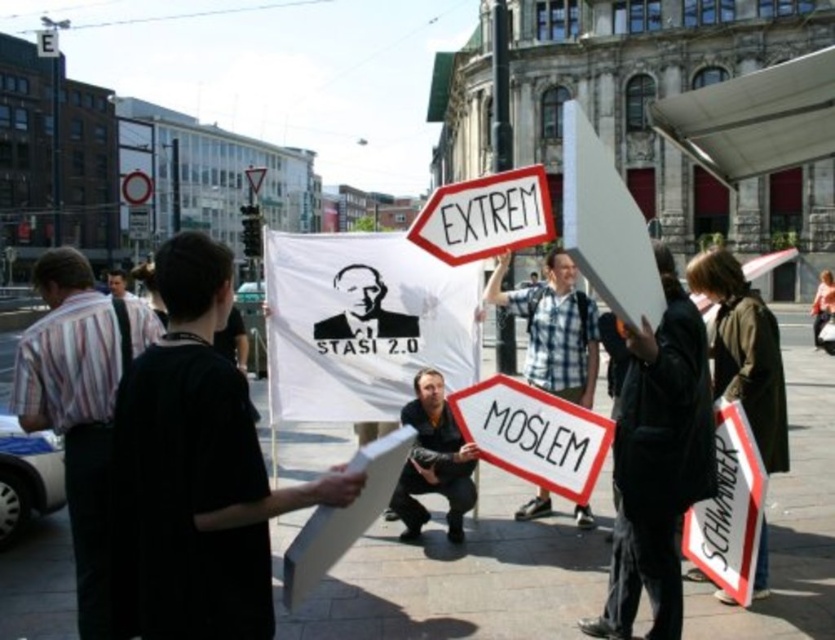
The height and width of the screenshot is (640, 835). I want to click on striped fabric shirt at left, so click(79, 406).

Does striped fabric shirt at left have a greater width compared to plaid fabric shirt at center?

Yes, striped fabric shirt at left is wider than plaid fabric shirt at center.

Identify the location of striped fabric shirt at left. (79, 406).

The width and height of the screenshot is (835, 640). I want to click on striped fabric shirt at left, so click(79, 406).

Is point (560, 273) positioned in front of point (134, 296)?

That is True.

Is point (545, 337) closer to camera compared to point (115, 288)?

Yes.

Image resolution: width=835 pixels, height=640 pixels. Identify the location of plaid fabric shirt at center. (553, 326).

Between point (535, 300) and point (468, 490), which one is positioned in front?

Positioned in front is point (468, 490).

Which is below, plaid fabric shirt at center or dark blue shirt at center?

dark blue shirt at center is lower down.

Is point (564, 376) in front of point (451, 500)?

No, (564, 376) is behind (451, 500).

Locate an element on the screen. This screenshot has width=835, height=640. plaid fabric shirt at center is located at coordinates (553, 326).